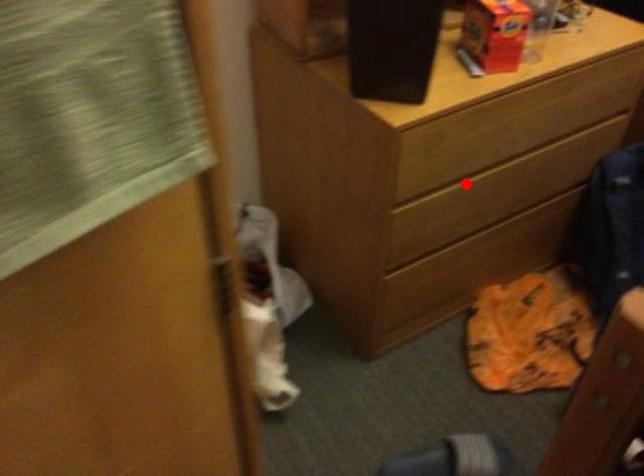
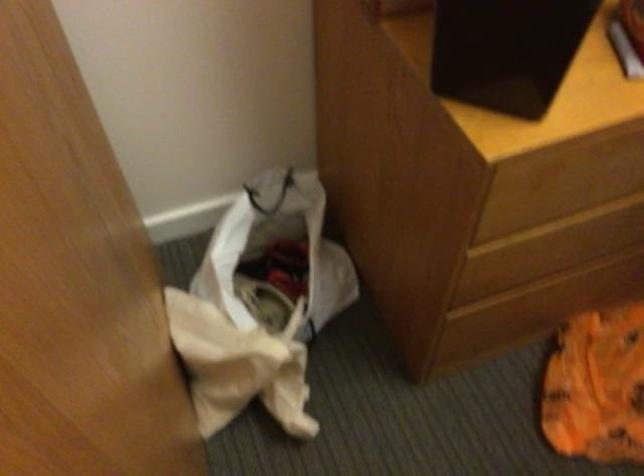
In the second image, find the point that corresponds to the highlighted location in the first image.

(585, 216)